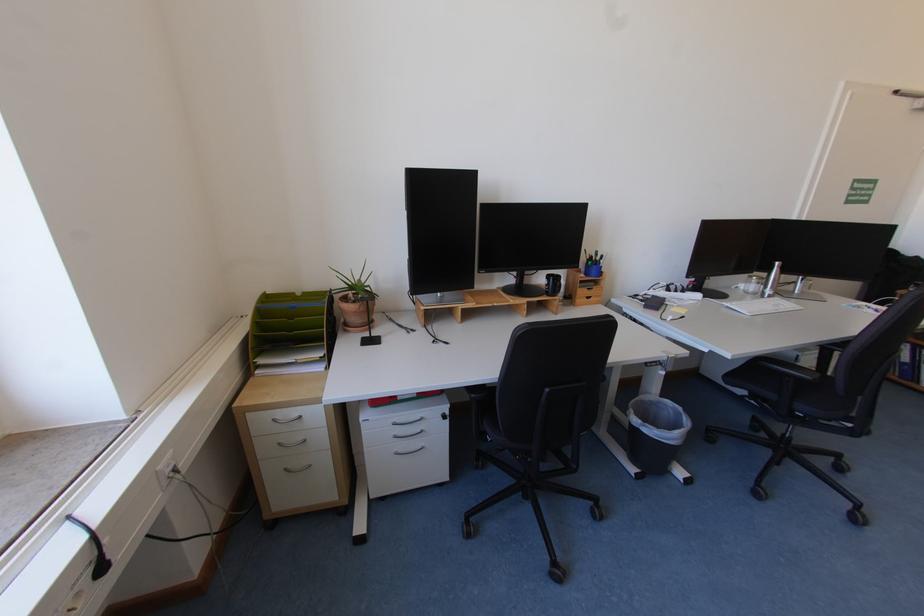
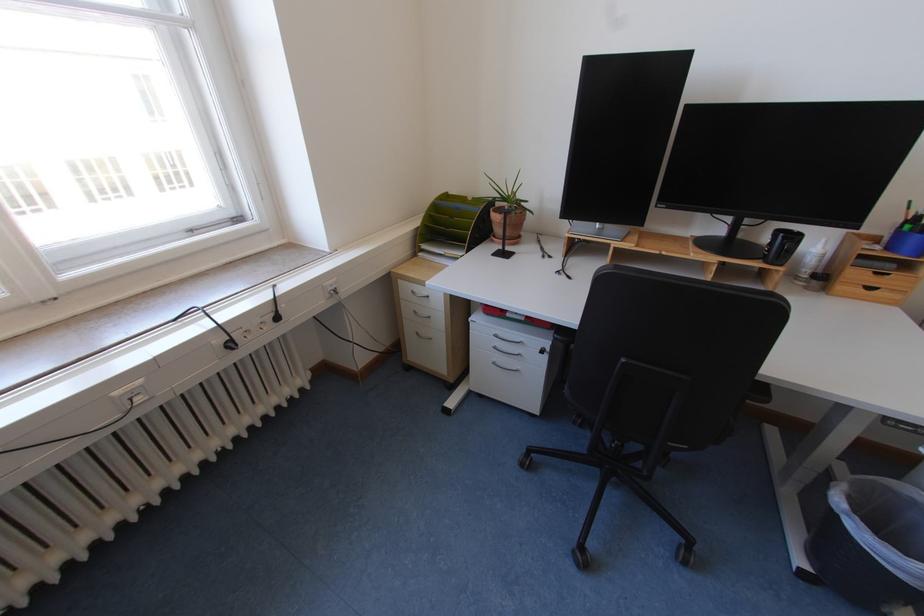
The point at (355, 286) is marked in the first image. Where is the corresponding point in the second image?

(506, 197)